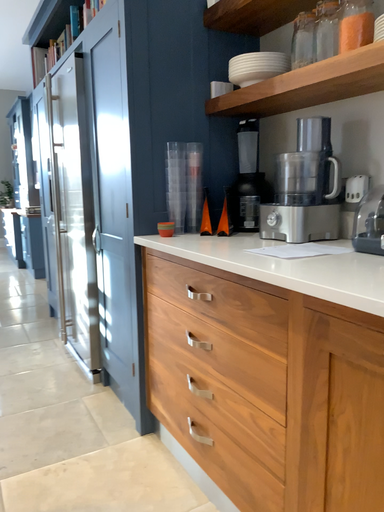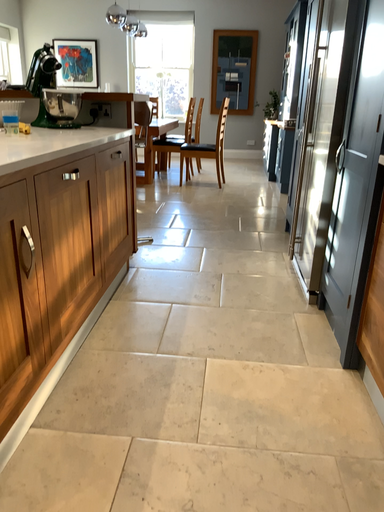
Question: How did the camera likely rotate when shooting the video?

Choices:
 (A) rotated right
 (B) rotated left

Answer: (B)